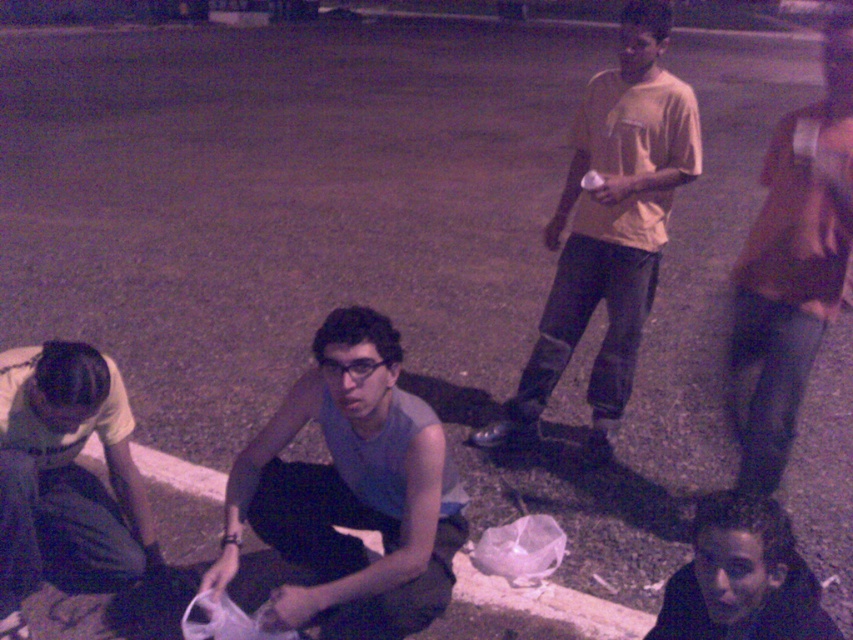
Looking at this image, you are at a night market and want to pick up the white plastic bag at lower center. Is the brown leather jacket at right blocking your path to it?

The brown leather jacket at right is in front of the white plastic bag at lower center, so it is blocking the path to the bag.

You are standing at point (215, 476) and want to walk to point (747, 388). Which direction should you move to reach your destination?

You should move backward because point (747, 388) is behind point (215, 476).

You are standing at the center of the image and want to find the light gray fabric pants at lower left. In which direction should you look to locate them?

The light gray fabric pants at lower left is located at point (x=65, y=477), which is to the lower left direction from your current position at the center of the image.